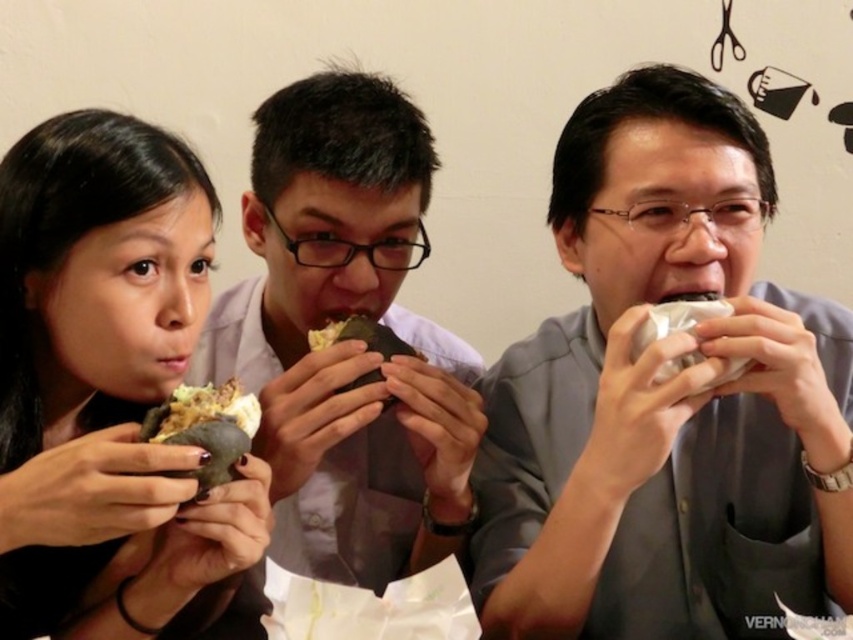
Question: Which point is closer to the camera?

Choices:
 (A) brown matte sandwich at center
 (B) white paper food at center
 (C) gray matte shirt at center
 (D) matte black sandwich at left

Answer: (D)

Question: Is matte black sandwich at center above white paper food at center?

Choices:
 (A) yes
 (B) no

Answer: (B)

Question: Based on their relative distances, which object is farther from the gray matte shirt at center?

Choices:
 (A) matte black sandwich at center
 (B) white paper food at center

Answer: (A)

Question: Does matte black sandwich at left have a smaller size compared to crumbly white bread at center?

Choices:
 (A) no
 (B) yes

Answer: (A)

Question: Can you confirm if crumbly white bread at center is wider than white paper food at center?

Choices:
 (A) yes
 (B) no

Answer: (B)

Question: Considering the real-world distances, which object is closest to the matte black sandwich at left?

Choices:
 (A) crumbly white bread at center
 (B) brown matte sandwich at center

Answer: (A)